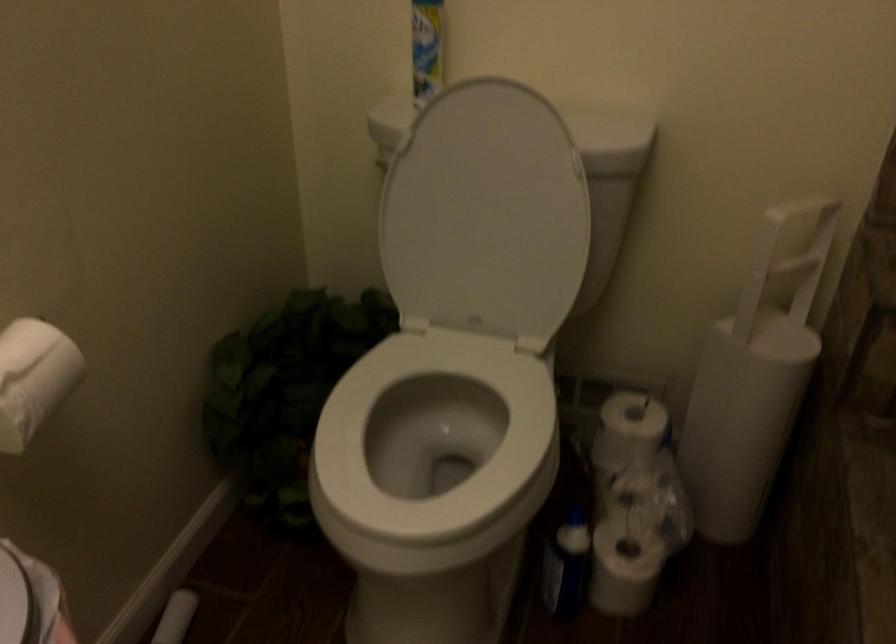
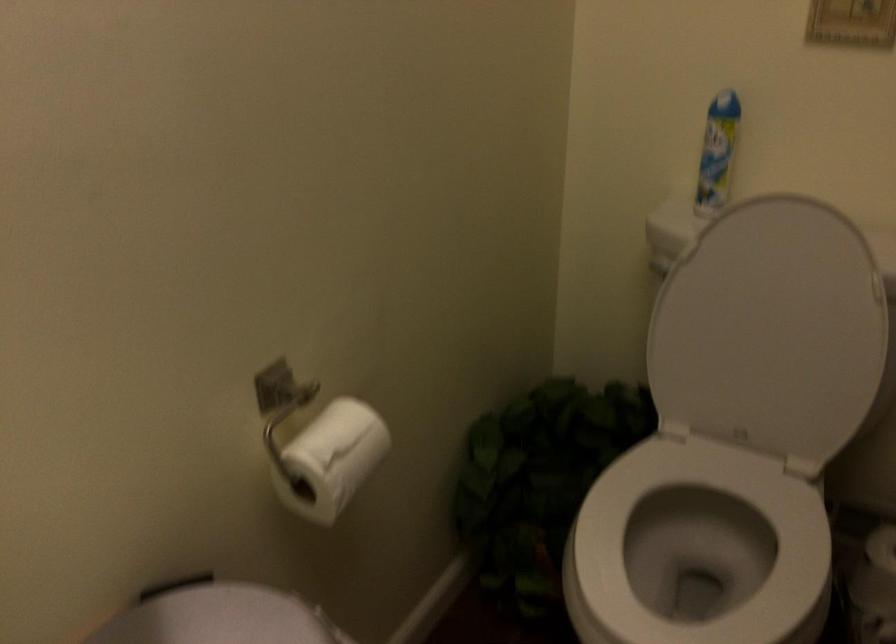
Question: In a continuous first-person perspective shot, in which direction is the camera moving?

Choices:
 (A) Left
 (B) Right
 (C) Forward
 (D) Backward

Answer: (A)